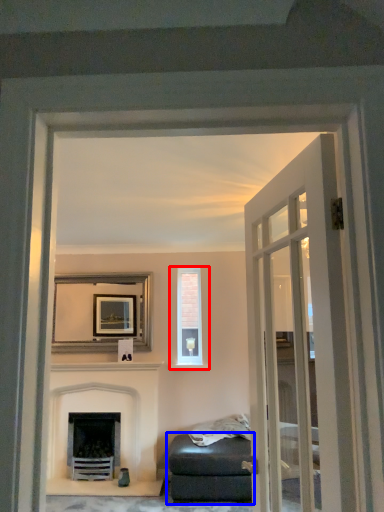
Question: Which object appears farthest to the camera in this image, window (highlighted by a red box) or studio couch (highlighted by a blue box)?

Choices:
 (A) window
 (B) studio couch

Answer: (A)